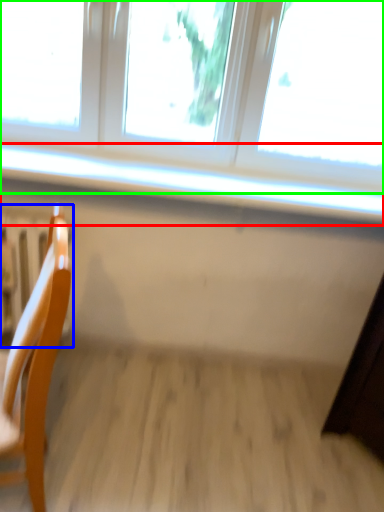
Question: Which object is the closest to the window sill (highlighted by a red box)? Choose among these: radiator (highlighted by a blue box) or window (highlighted by a green box).

Choices:
 (A) radiator
 (B) window

Answer: (B)